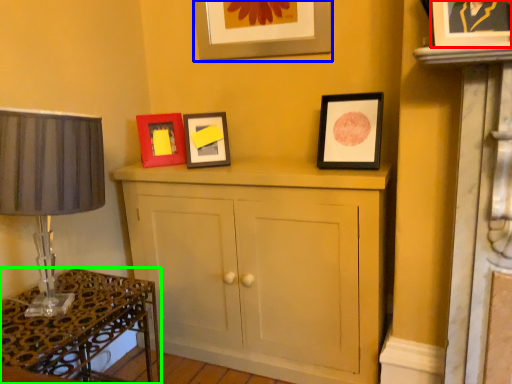
Question: Considering the real-world distances, which object is farthest from picture frame (highlighted by a red box)? picture frame (highlighted by a blue box) or table (highlighted by a green box)?

Choices:
 (A) picture frame
 (B) table

Answer: (B)